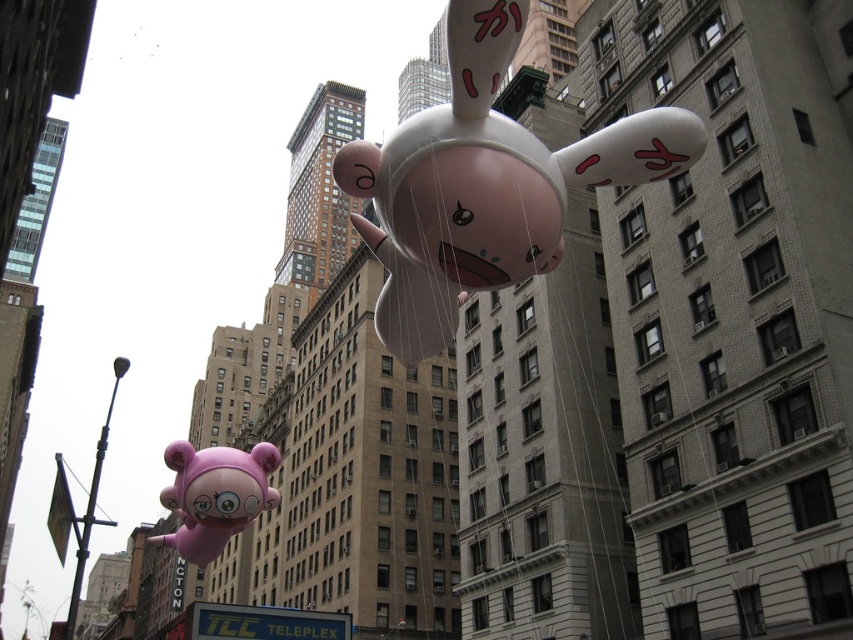
You are a city planner assessing safety in the area. You need to ensure that the pink rubber balloon at center and the matte pink balloon at lower left are at least 20 meters apart to prevent tangling. Based on the scene, are they compliant with this safety regulation?

The distance between the pink rubber balloon at center and the matte pink balloon at lower left is 20.62 meters, which exceeds the required 20 meters. Therefore, they are compliant with the safety regulation.

You are an urban planner assessing the city for safety. You notice two balloons, the pink rubber balloon at center and the matte pink balloon at lower left. Based on their heights, which balloon might pose a lower risk of obstructing air traffic?

The pink rubber balloon at center has a lesser height compared to the matte pink balloon at lower left, so it might pose a lower risk of obstructing air traffic.

You are a city planner analyzing the image. You need to determine the exact position of the pink rubber balloon at center. What are its coordinates?

The pink rubber balloon at center is located at coordinates (485, 184).